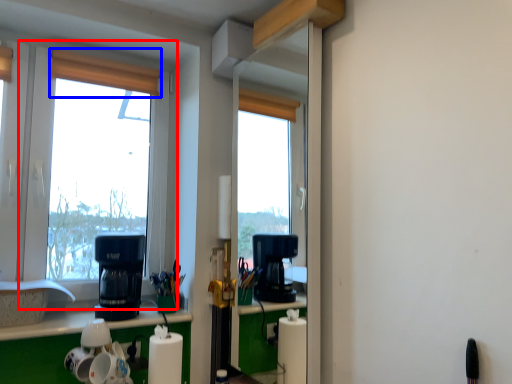
Question: Which of the following is the closest to the observer, window (highlighted by a red box) or curtain (highlighted by a blue box)?

Choices:
 (A) window
 (B) curtain

Answer: (A)